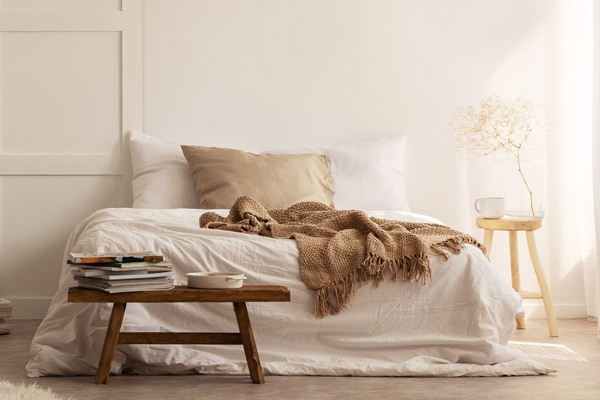
In order to click on blanket in this screenshot , I will do `click(305, 219)`.